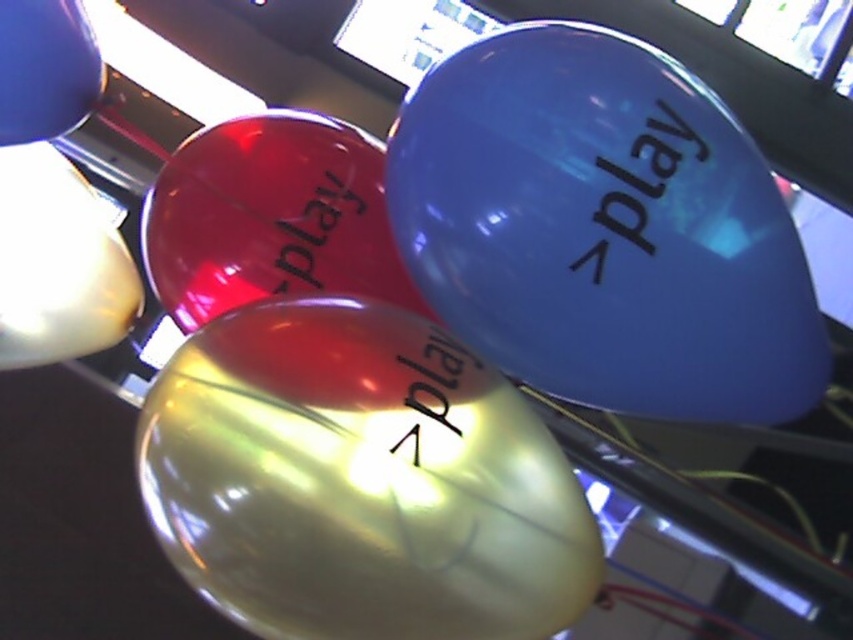
Is translucent yellow balloon at center shorter than matte yellow balloon at left?

In fact, translucent yellow balloon at center may be taller than matte yellow balloon at left.

How much distance is there between translucent yellow balloon at center and matte yellow balloon at left?

The distance of translucent yellow balloon at center from matte yellow balloon at left is 16.24 inches.

Which is in front, point (271, 616) or point (0, 154)?

Point (271, 616) is more forward.

The height and width of the screenshot is (640, 853). Find the location of `translucent yellow balloon at center`. translucent yellow balloon at center is located at coordinates (360, 481).

Which of these two, glossy blue balloon at upper right or glossy red play at center, stands shorter?

glossy red play at center

Is glossy blue balloon at upper right positioned in front of glossy red play at center?

Yes, glossy blue balloon at upper right is closer to the viewer.

Is point (543, 132) more distant than point (328, 253)?

No, (543, 132) is in front of (328, 253).

Find the location of a particular element. glossy blue balloon at upper right is located at coordinates (604, 228).

Can you confirm if glossy blue balloon at upper right is thinner than matte blue balloon at upper left?

No, glossy blue balloon at upper right is not thinner than matte blue balloon at upper left.

Who is positioned more to the left, glossy blue balloon at upper right or matte blue balloon at upper left?

matte blue balloon at upper left

Find the location of a particular element. glossy blue balloon at upper right is located at coordinates (604, 228).